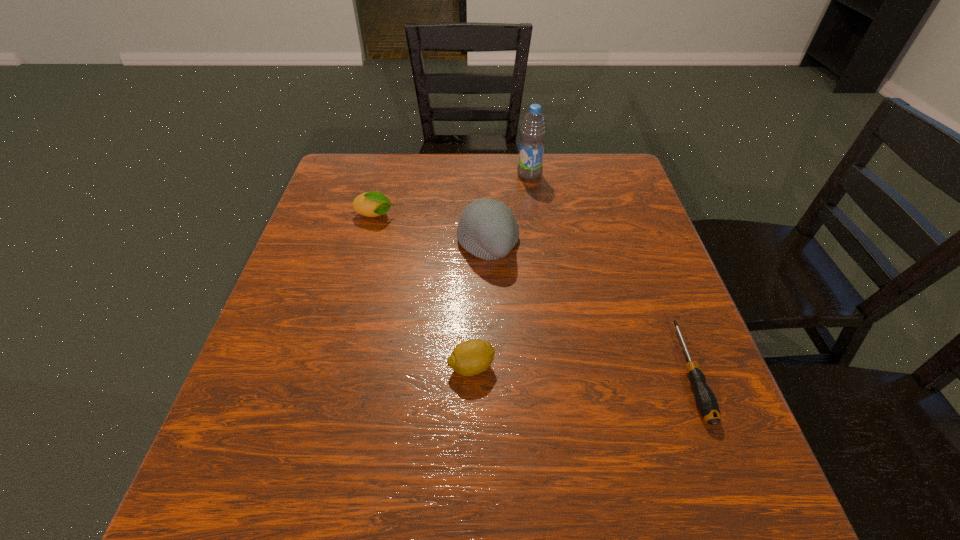
In the image, there is a desktop. At what (x,y) coordinates should I click in order to perform the action: click on vacant space at the right edge. Please return your answer as a coordinate pair (x, y). The image size is (960, 540). Looking at the image, I should click on (612, 219).

In the image, there is a desktop. Where is `vacant space at the far left corner`? The width and height of the screenshot is (960, 540). vacant space at the far left corner is located at coordinates (346, 180).

The image size is (960, 540). I want to click on vacant space at the far right corner, so click(603, 168).

I want to click on free spot between the second object from right to left and the rightmost object, so click(610, 273).

Find the location of `vacant point located between the fourth object from left to right and the shortest object`. vacant point located between the fourth object from left to right and the shortest object is located at coordinates (610, 273).

The height and width of the screenshot is (540, 960). I want to click on vacant space that is in between the second tallest object and the shortest object, so click(x=588, y=308).

Where is `free space between the shorter lemon and the left lemon`? This screenshot has height=540, width=960. free space between the shorter lemon and the left lemon is located at coordinates (423, 291).

Where is `free space between the fourth tallest object and the farther lemon`? The height and width of the screenshot is (540, 960). free space between the fourth tallest object and the farther lemon is located at coordinates (423, 291).

The height and width of the screenshot is (540, 960). Identify the location of vacant space that's between the right lemon and the beanie. (480, 305).

The image size is (960, 540). Find the location of `free spot between the nearer lemon and the fourth shortest object`. free spot between the nearer lemon and the fourth shortest object is located at coordinates (480, 305).